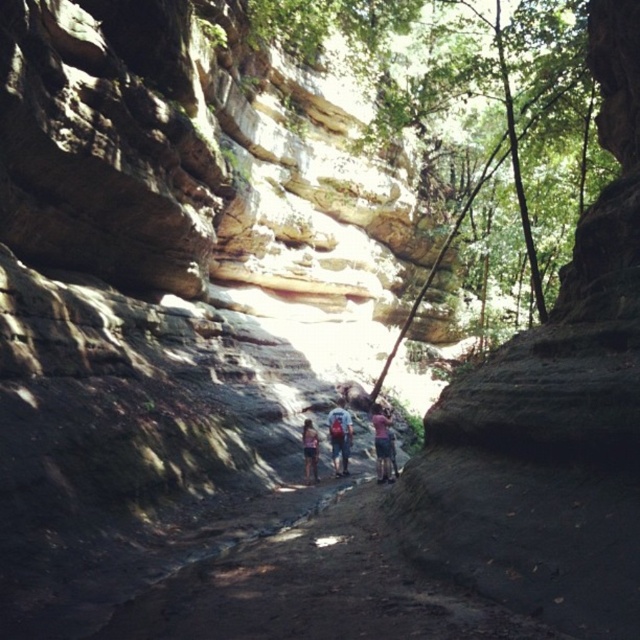
You are a photographer standing at the entrance of the canyon. You want to take a photo that includes both the pink fabric at center and denim shorts at center. Given that your camera has a maximum focus range of 6 meters, will you be able to capture both subjects in focus without moving closer?

The pink fabric at center and denim shorts at center are 6.43 meters apart from each other. Since the camera can only focus within 6 meters, the distance between them exceeds the maximum focus range. Therefore, you cannot capture both subjects in focus without moving closer.

You are a hiker who just entered the rocky canyon and you see the pink fabric at center and the denim shorts at center. Which one is bigger in size?

The pink fabric at center has a larger size compared to denim shorts at center, so the pink fabric at center is bigger.